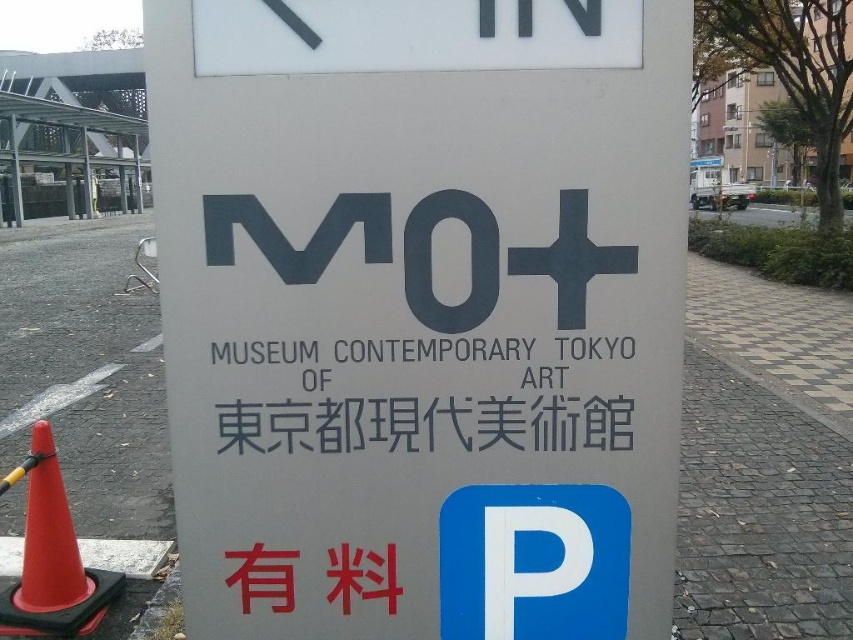
Question: Can you confirm if satin gray sign at center is positioned below blackmaterial/texturetext at center?

Choices:
 (A) no
 (B) yes

Answer: (A)

Question: Is satin gray sign at center closer to the viewer compared to orange plastic traffic cone at lower left?

Choices:
 (A) no
 (B) yes

Answer: (B)

Question: Which point is farther to the camera?

Choices:
 (A) blackmaterial/texturetext at center
 (B) orange plastic traffic cone at lower left
 (C) satin gray sign at center

Answer: (B)

Question: Which point is farther to the camera?

Choices:
 (A) (68, 579)
 (B) (570, 276)

Answer: (A)

Question: Among these points, which one is farthest from the camera?

Choices:
 (A) (24, 524)
 (B) (379, 541)

Answer: (A)

Question: Is satin gray sign at center below orange plastic traffic cone at lower left?

Choices:
 (A) yes
 (B) no

Answer: (B)